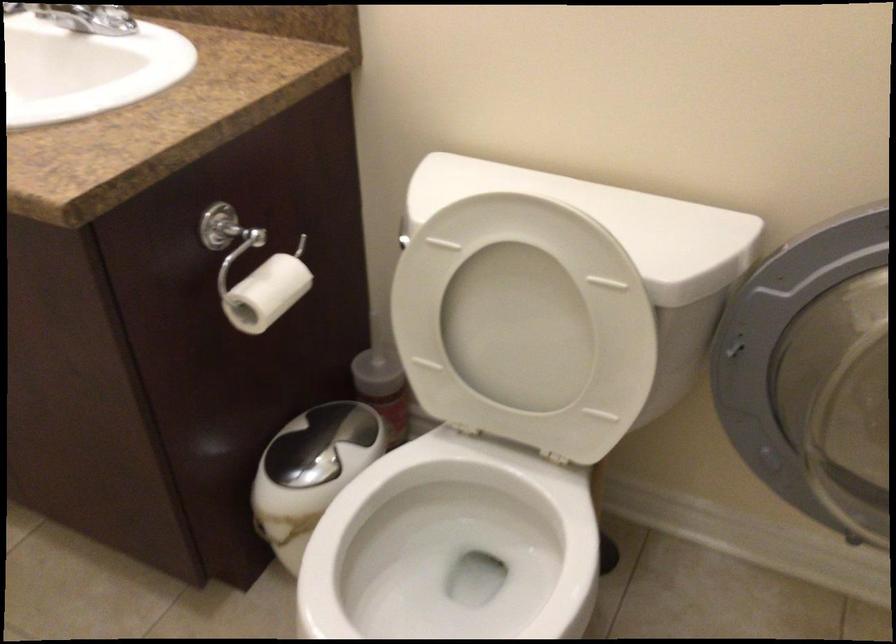
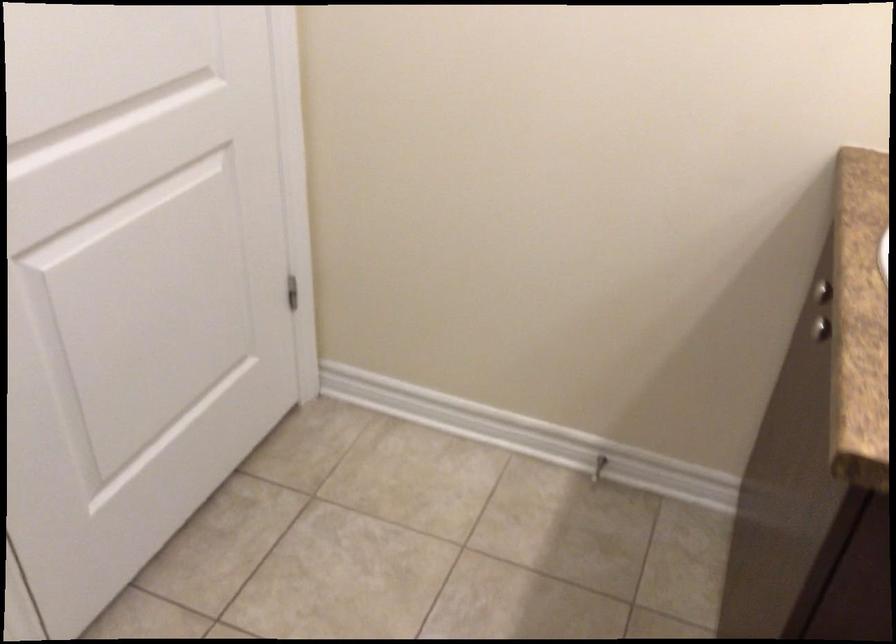
How did the camera likely rotate?

The rotation direction of the camera is left-down.